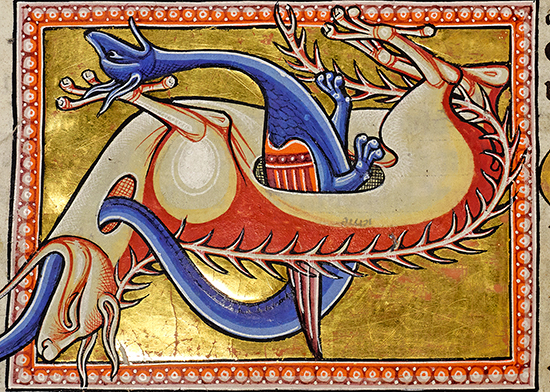
I want to click on right and left side of rug, beige section, so click(x=7, y=94), click(x=544, y=140).